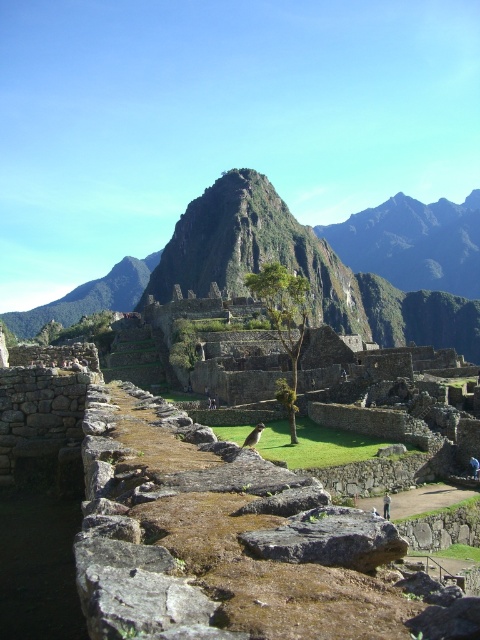
Question: Can you confirm if gray rough rock at center is positioned below green leafy tree at center?

Choices:
 (A) yes
 (B) no

Answer: (A)

Question: Can you confirm if gray rough rock at center is positioned to the right of green leafy tree at center?

Choices:
 (A) yes
 (B) no

Answer: (B)

Question: Among these points, which one is farthest from the camera?

Choices:
 (A) (305, 545)
 (B) (245, 228)
 (C) (275, 296)

Answer: (B)

Question: Estimate the real-world distances between objects in this image. Which object is closer to the green leafy tree at center?

Choices:
 (A) green grassy mountain at center
 (B) gray rough rock at center

Answer: (B)

Question: Is green grassy mountain at center in front of gray rough rock at center?

Choices:
 (A) yes
 (B) no

Answer: (B)

Question: Which object is the farthest from the green grassy mountain at center?

Choices:
 (A) green leafy tree at center
 (B) gray rough rock at center

Answer: (B)